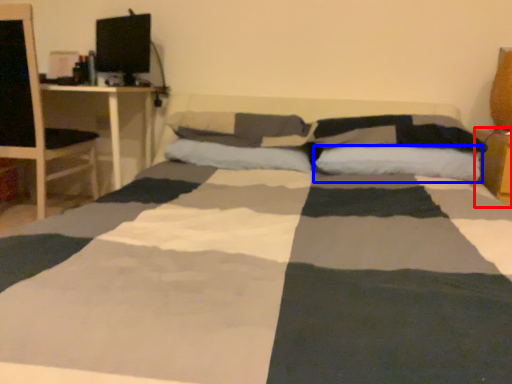
Question: Which object appears farthest to the camera in this image, table (highlighted by a red box) or pillow (highlighted by a blue box)?

Choices:
 (A) table
 (B) pillow

Answer: (A)